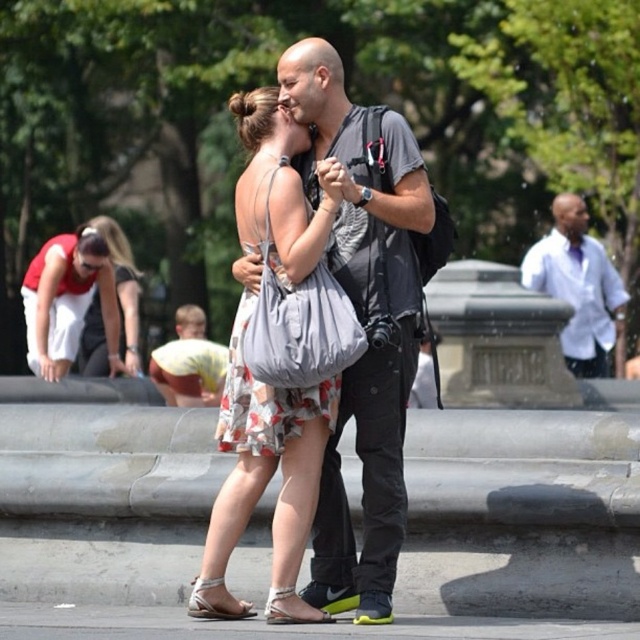
Is point (125, 346) more distant than point (253, 612)?

Yes.

Can you confirm if matte black sunglasses at lower left is smaller than white fabric sandal at lower center?

Actually, matte black sunglasses at lower left might be larger than white fabric sandal at lower center.

Does point (138, 337) come behind point (248, 604)?

Yes, it is.

At what (x,y) coordinates should I click in order to perform the action: click on matte black sunglasses at lower left. Please return your answer as a coordinate pair (x, y). This screenshot has height=640, width=640. Looking at the image, I should click on (124, 289).

Does floral cotton dress at center have a lesser height compared to white leather sandal at lower center?

In fact, floral cotton dress at center may be taller than white leather sandal at lower center.

Is the position of floral cotton dress at center less distant than that of white leather sandal at lower center?

That is False.

Does point (294, 460) lie behind point (332, 621)?

Yes, point (294, 460) is farther from viewer.

Where is `floral cotton dress at center`? This screenshot has width=640, height=640. floral cotton dress at center is located at coordinates (268, 460).

Who is shorter, matte gray shirt at center or matte black sunglasses at lower left?

Standing shorter between the two is matte black sunglasses at lower left.

Which is more to the left, matte gray shirt at center or matte black sunglasses at lower left?

From the viewer's perspective, matte black sunglasses at lower left appears more on the left side.

Measure the distance between point (388,202) and camera.

A distance of 102.70 feet exists between point (388,202) and camera.

Locate an element on the screen. matte gray shirt at center is located at coordinates (364, 308).